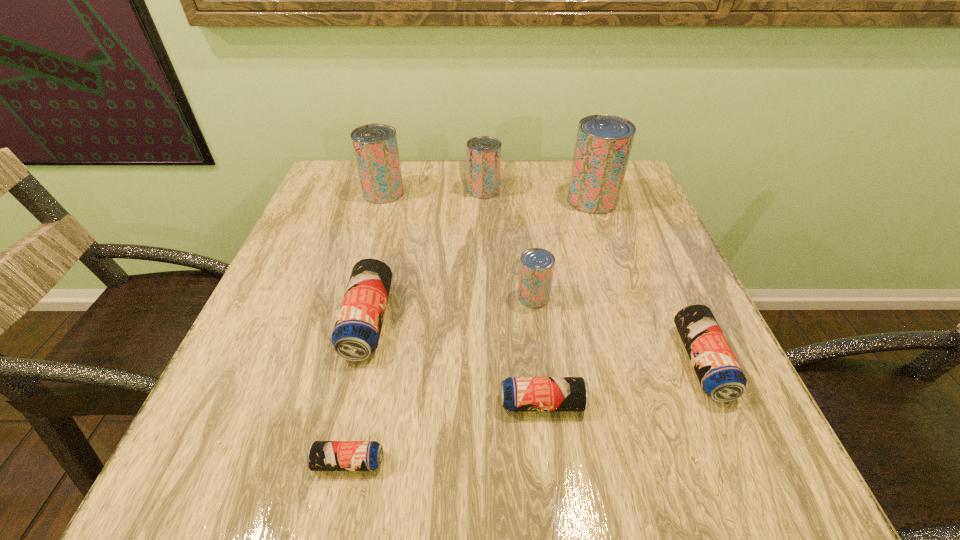
Locate an element on the screen. The image size is (960, 540). the rightmost blue beer can is located at coordinates (719, 373).

What are the coordinates of `the third shortest object` in the screenshot? It's located at pyautogui.click(x=719, y=373).

This screenshot has width=960, height=540. I want to click on the seventh tallest beer can, so click(517, 393).

You are a GUI agent. You are given a task and a screenshot of the screen. Output one action in this format:
    pyautogui.click(x=<x>, y=<y>)
    Task: Click on the second blue beer can from right to left
    The height and width of the screenshot is (540, 960).
    Given the screenshot: What is the action you would take?
    pyautogui.click(x=517, y=393)

This screenshot has width=960, height=540. In order to click on the smallest blue beer can in this screenshot , I will do `click(322, 455)`.

Find the location of `the nearest beer can`. the nearest beer can is located at coordinates (322, 455).

Identify the location of vacant space situated 0.080m on the back of the tallest object. The width and height of the screenshot is (960, 540). (583, 171).

At what (x,y) coordinates should I click in order to perform the action: click on free space located on the front of the second biggest red beer can. Please return your answer as a coordinate pair (x, y). Image resolution: width=960 pixels, height=540 pixels. Looking at the image, I should click on (365, 255).

Image resolution: width=960 pixels, height=540 pixels. In order to click on free space located 0.320m on the front of the sixth shortest object in this screenshot , I will do `click(485, 286)`.

The width and height of the screenshot is (960, 540). In order to click on vacant space located on the back of the fourth tallest beer can in this screenshot , I will do `click(524, 219)`.